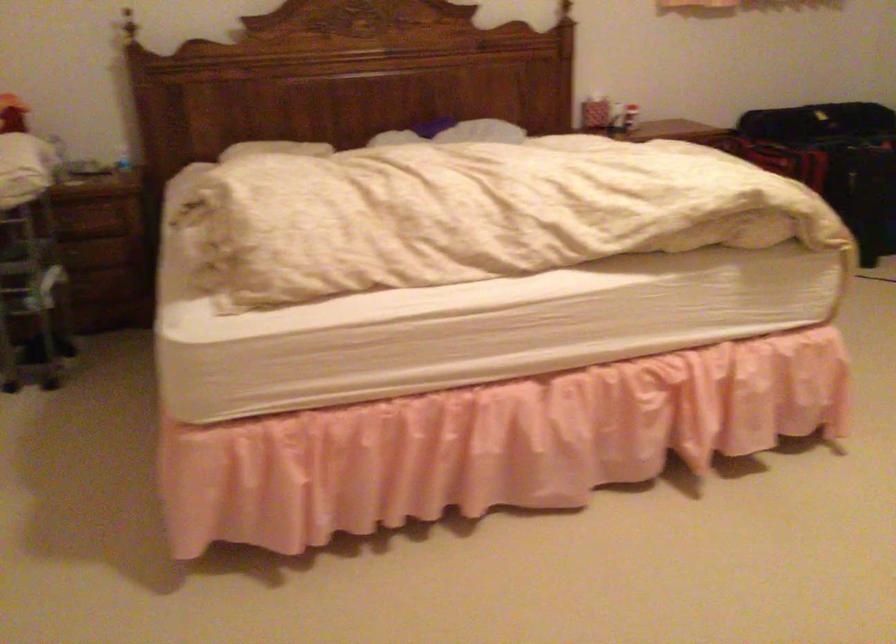
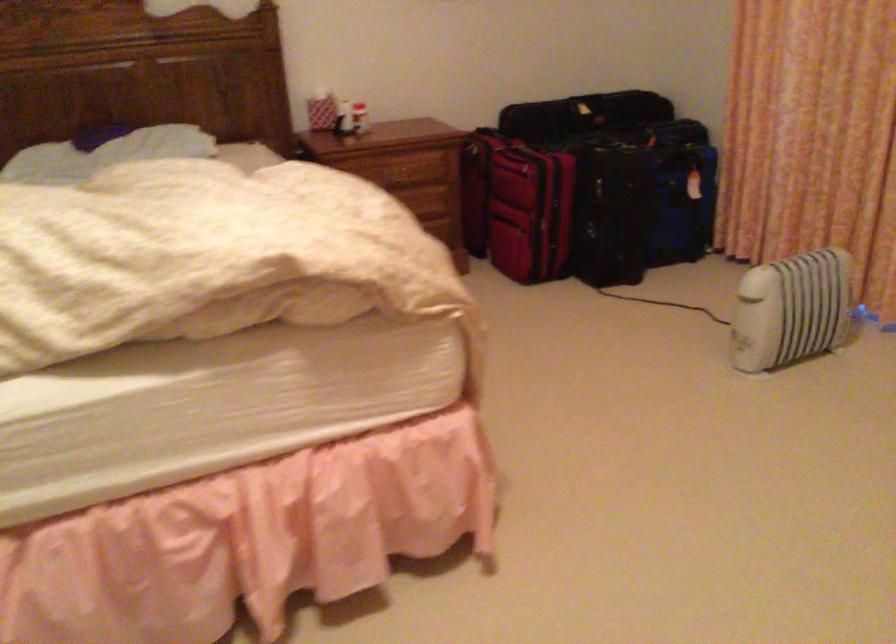
Which direction would the cameraman need to move to produce the second image?

The movement direction of the cameraman is right, forward.